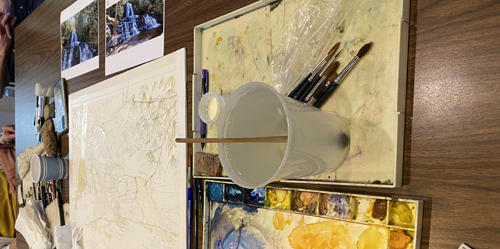
The height and width of the screenshot is (249, 500). I want to click on cups, so click(x=312, y=141), click(x=49, y=169).